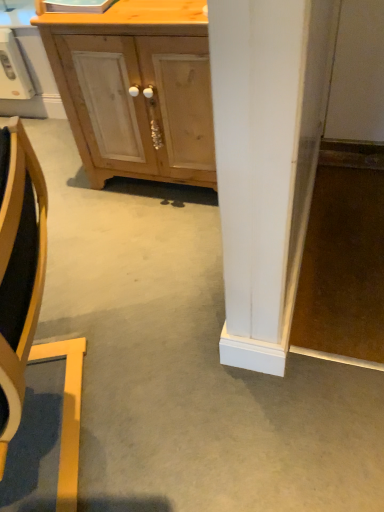
Question: Is there a large distance between wooden chair at left and light wood cabinet at center?

Choices:
 (A) no
 (B) yes

Answer: (B)

Question: Does wooden chair at left appear on the left side of light wood cabinet at center?

Choices:
 (A) no
 (B) yes

Answer: (B)

Question: Considering the relative sizes of wooden chair at left and light wood cabinet at center in the image provided, is wooden chair at left smaller than light wood cabinet at center?

Choices:
 (A) no
 (B) yes

Answer: (A)

Question: Is wooden chair at left positioned with its back to light wood cabinet at center?

Choices:
 (A) no
 (B) yes

Answer: (A)

Question: Is wooden chair at left at the right side of light wood cabinet at center?

Choices:
 (A) yes
 (B) no

Answer: (B)

Question: Is light wood cabinet at center bigger or smaller than white plastic microwave at upper left?

Choices:
 (A) big
 (B) small

Answer: (A)

Question: From a real-world perspective, is light wood cabinet at center positioned above or below white plastic microwave at upper left?

Choices:
 (A) below
 (B) above

Answer: (B)

Question: In terms of width, does light wood cabinet at center look wider or thinner when compared to white plastic microwave at upper left?

Choices:
 (A) wide
 (B) thin

Answer: (A)

Question: Would you say light wood cabinet at center is to the left or to the right of white plastic microwave at upper left in the picture?

Choices:
 (A) left
 (B) right

Answer: (B)

Question: Do you think light wood cabinet at center is within wooden chair at left, or outside of it?

Choices:
 (A) outside
 (B) inside

Answer: (A)

Question: Looking at the image, does light wood cabinet at center seem bigger or smaller compared to wooden chair at left?

Choices:
 (A) big
 (B) small

Answer: (B)

Question: Visually, is light wood cabinet at center positioned to the left or to the right of wooden chair at left?

Choices:
 (A) right
 (B) left

Answer: (A)

Question: Relative to wooden chair at left, is light wood cabinet at center in front or behind?

Choices:
 (A) behind
 (B) front

Answer: (A)

Question: Considering their positions, is wooden chair at left located in front of or behind white plastic microwave at upper left?

Choices:
 (A) behind
 (B) front

Answer: (B)

Question: From the image's perspective, is wooden chair at left located above or below white plastic microwave at upper left?

Choices:
 (A) below
 (B) above

Answer: (A)